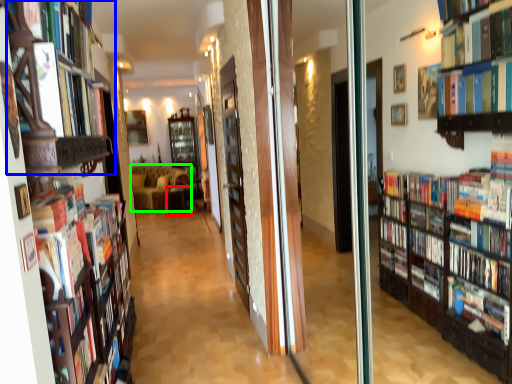
Question: Which is nearer to the furniture (highlighted by a red box)? shelf (highlighted by a blue box) or couch (highlighted by a green box).

Choices:
 (A) shelf
 (B) couch

Answer: (B)